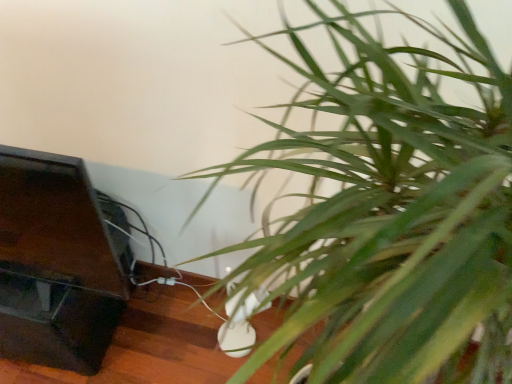
Question: Is green leafy plant at lower right placed right next to dark wood table at lower left?

Choices:
 (A) no
 (B) yes

Answer: (A)

Question: Does green leafy plant at lower right have a lesser width compared to dark wood table at lower left?

Choices:
 (A) no
 (B) yes

Answer: (A)

Question: From a real-world perspective, is green leafy plant at lower right positioned over dark wood table at lower left based on gravity?

Choices:
 (A) no
 (B) yes

Answer: (B)

Question: Considering the relative positions of green leafy plant at lower right and dark wood table at lower left in the image provided, is green leafy plant at lower right to the right of dark wood table at lower left from the viewer's perspective?

Choices:
 (A) yes
 (B) no

Answer: (A)

Question: Is green leafy plant at lower right not near dark wood table at lower left?

Choices:
 (A) yes
 (B) no

Answer: (B)

Question: Is green leafy plant at lower right shorter than dark wood table at lower left?

Choices:
 (A) no
 (B) yes

Answer: (A)

Question: Considering the relative positions of dark wood table at lower left and green leafy plant at lower right in the image provided, is dark wood table at lower left to the right of green leafy plant at lower right from the viewer's perspective?

Choices:
 (A) no
 (B) yes

Answer: (A)

Question: Can you confirm if dark wood table at lower left is thinner than green leafy plant at lower right?

Choices:
 (A) yes
 (B) no

Answer: (A)

Question: Is the depth of dark wood table at lower left greater than that of green leafy plant at lower right?

Choices:
 (A) no
 (B) yes

Answer: (B)

Question: From the image's perspective, is dark wood table at lower left below green leafy plant at lower right?

Choices:
 (A) no
 (B) yes

Answer: (B)

Question: Is dark wood table at lower left shorter than green leafy plant at lower right?

Choices:
 (A) yes
 (B) no

Answer: (A)

Question: Is dark wood table at lower left next to green leafy plant at lower right and touching it?

Choices:
 (A) yes
 (B) no

Answer: (B)

Question: From the image's perspective, relative to green leafy plant at lower right, is dark wood table at lower left above or below?

Choices:
 (A) above
 (B) below

Answer: (B)